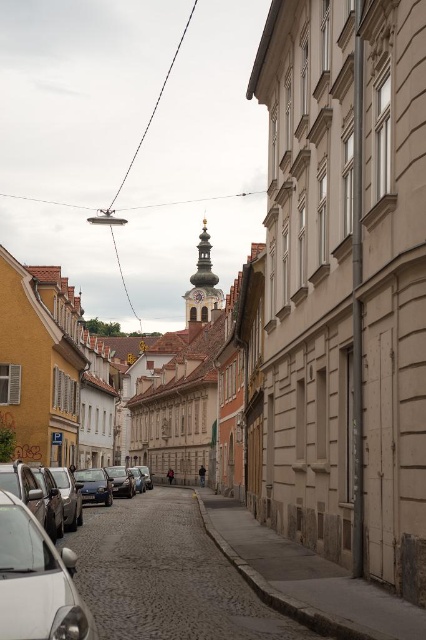
In the scene shown: You are a delivery person trying to navigate through the narrow cobblestone street. You need to pass by the silver metallic car at lower left. Which direction should you turn to continue along the smooth cobblestone alley at center?

You should turn to the right to continue along the smooth cobblestone alley at center since it is located to the right of the silver metallic car at lower left.